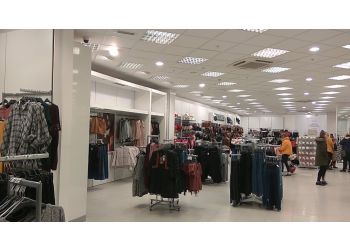
Find the location of `ceiling`. ceiling is located at coordinates [x=218, y=54].